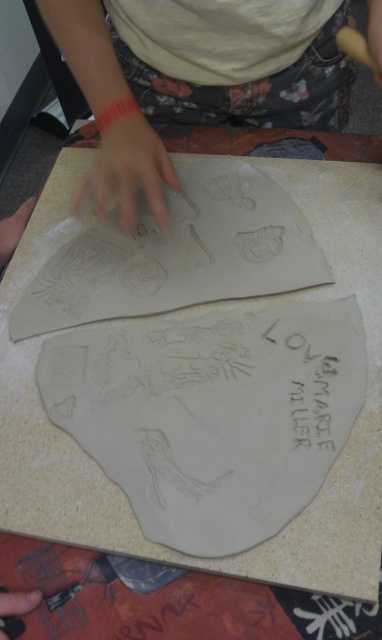
Question: Observing the image, what is the correct spatial positioning of matte gray hand at upper center in reference to smooth skin at center?

Choices:
 (A) right
 (B) left

Answer: (B)

Question: Can you confirm if matte clay hand at center is wider than black matte hand at lower left?

Choices:
 (A) no
 (B) yes

Answer: (B)

Question: Which point is closer to the camera taking this photo?

Choices:
 (A) (131, 170)
 (B) (14, 230)

Answer: (A)

Question: Which point is closer to the camera?

Choices:
 (A) smooth skin at center
 (B) matte clay hand at center
 (C) matte gray hand at upper center

Answer: (A)

Question: Estimate the real-world distances between objects in this image. Which object is farther from the matte gray clay hand at upper left?

Choices:
 (A) matte gray hand at upper center
 (B) black matte hand at lower left
 (C) matte clay hand at center

Answer: (B)

Question: Does smooth skin at center come behind black matte hand at lower left?

Choices:
 (A) no
 (B) yes

Answer: (B)